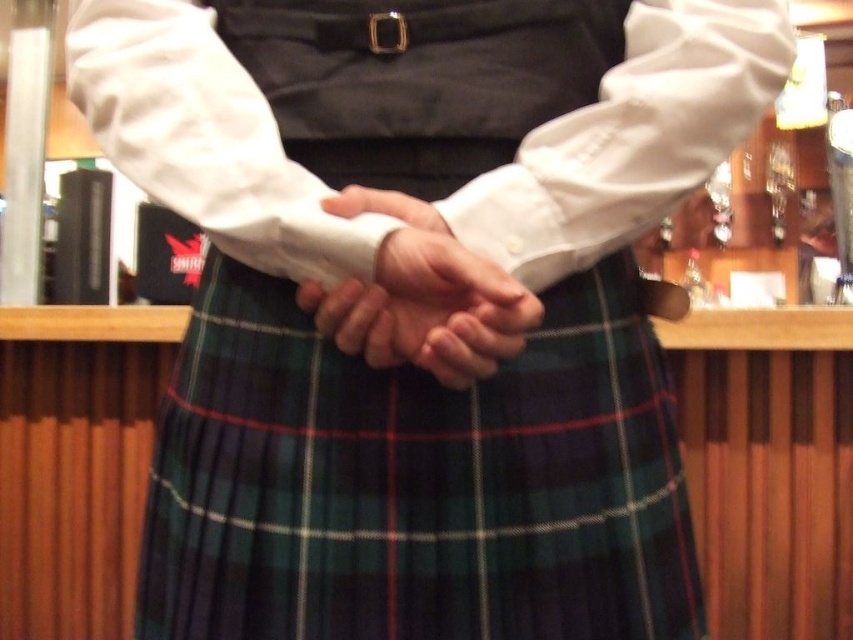
Does white smooth shirt at center have a greater width compared to white matte shirt at center?

Yes.

Does white smooth shirt at center have a greater height compared to white matte shirt at center?

Correct, white smooth shirt at center is much taller as white matte shirt at center.

Does point (206, 51) come in front of point (312, 282)?

No, it is behind (312, 282).

Identify the location of white smooth shirt at center. click(x=630, y=138).

Who is lower down, green plaid kilt at center or white matte shirt at center?

Positioned lower is green plaid kilt at center.

Is green plaid kilt at center wider than white matte shirt at center?

Yes.

What do you see at coordinates (416, 481) in the screenshot? I see `green plaid kilt at center` at bounding box center [416, 481].

The image size is (853, 640). Find the location of `green plaid kilt at center`. green plaid kilt at center is located at coordinates (416, 481).

Is point (376, 374) less distant than point (294, 250)?

No.

Describe the element at coordinates (416, 481) in the screenshot. I see `green plaid kilt at center` at that location.

Find the location of a particular element. This screenshot has height=640, width=853. green plaid kilt at center is located at coordinates (416, 481).